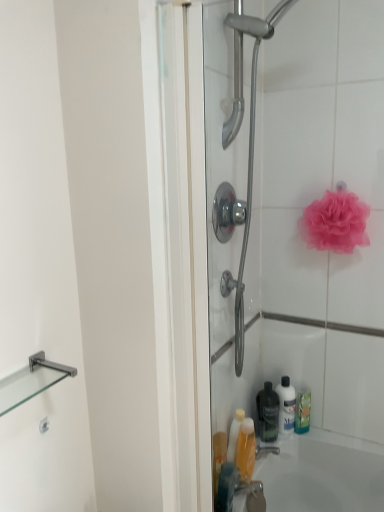
Question: Considering the relative sizes of black matte bottle at lower center and pink mesh sponge at upper right in the image provided, is black matte bottle at lower center smaller than pink mesh sponge at upper right?

Choices:
 (A) no
 (B) yes

Answer: (B)

Question: From the image's perspective, does black matte bottle at lower center appear lower than pink mesh sponge at upper right?

Choices:
 (A) yes
 (B) no

Answer: (A)

Question: From the image's perspective, is black matte bottle at lower center on pink mesh sponge at upper right?

Choices:
 (A) no
 (B) yes

Answer: (A)

Question: Is black matte bottle at lower center closer to the viewer compared to pink mesh sponge at upper right?

Choices:
 (A) no
 (B) yes

Answer: (A)

Question: Does black matte bottle at lower center lie behind pink mesh sponge at upper right?

Choices:
 (A) no
 (B) yes

Answer: (B)

Question: Considering the positions of translucent plastic bottle at lower center and clear glass shelf at left in the image, is translucent plastic bottle at lower center wider or thinner than clear glass shelf at left?

Choices:
 (A) thin
 (B) wide

Answer: (A)

Question: From their relative heights in the image, would you say translucent plastic bottle at lower center is taller or shorter than clear glass shelf at left?

Choices:
 (A) tall
 (B) short

Answer: (A)

Question: Does point (241, 439) appear closer or farther from the camera than point (23, 379)?

Choices:
 (A) closer
 (B) farther

Answer: (B)

Question: Do you think translucent plastic bottle at lower center is within clear glass shelf at left, or outside of it?

Choices:
 (A) inside
 (B) outside

Answer: (B)

Question: Considering their positions, is clear glass shelf at left located in front of or behind translucent plastic bottle at lower right, which is the 2th cleaning product from left to right?

Choices:
 (A) front
 (B) behind

Answer: (A)

Question: From the image's perspective, is clear glass shelf at left above or below translucent plastic bottle at lower right, acting as the third cleaning product starting from the front?

Choices:
 (A) above
 (B) below

Answer: (A)

Question: Do you think clear glass shelf at left is within translucent plastic bottle at lower right, positioned as the first cleaning product in back-to-front order, or outside of it?

Choices:
 (A) outside
 (B) inside

Answer: (A)

Question: From a real-world perspective, relative to translucent plastic bottle at lower right, acting as the third cleaning product starting from the front, is clear glass shelf at left vertically above or below?

Choices:
 (A) above
 (B) below

Answer: (A)

Question: From the image's perspective, is black matte bottle at lower center above or below translucent plastic bottle at lower center?

Choices:
 (A) below
 (B) above

Answer: (B)

Question: In the image, is black matte bottle at lower center positioned in front of or behind translucent plastic bottle at lower center?

Choices:
 (A) front
 (B) behind

Answer: (B)